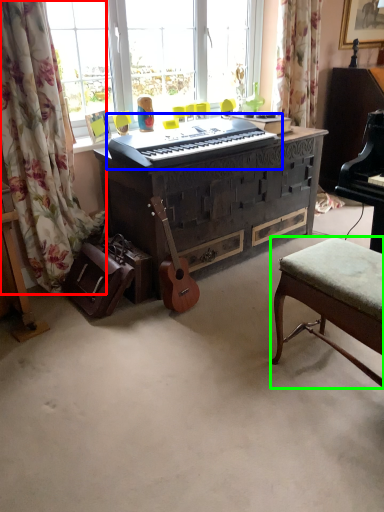
Question: Considering the real-world distances, which object is closest to curtain (highlighted by a red box)? musical keyboard (highlighted by a blue box) or stool (highlighted by a green box).

Choices:
 (A) musical keyboard
 (B) stool

Answer: (A)